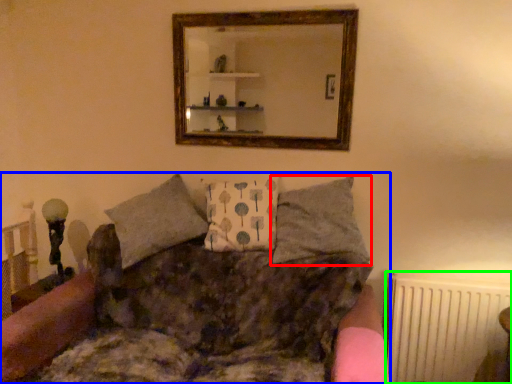
Question: Considering the real-world distances, which object is farthest from pillow (highlighted by a red box)? studio couch (highlighted by a blue box) or radiator (highlighted by a green box)?

Choices:
 (A) studio couch
 (B) radiator

Answer: (B)